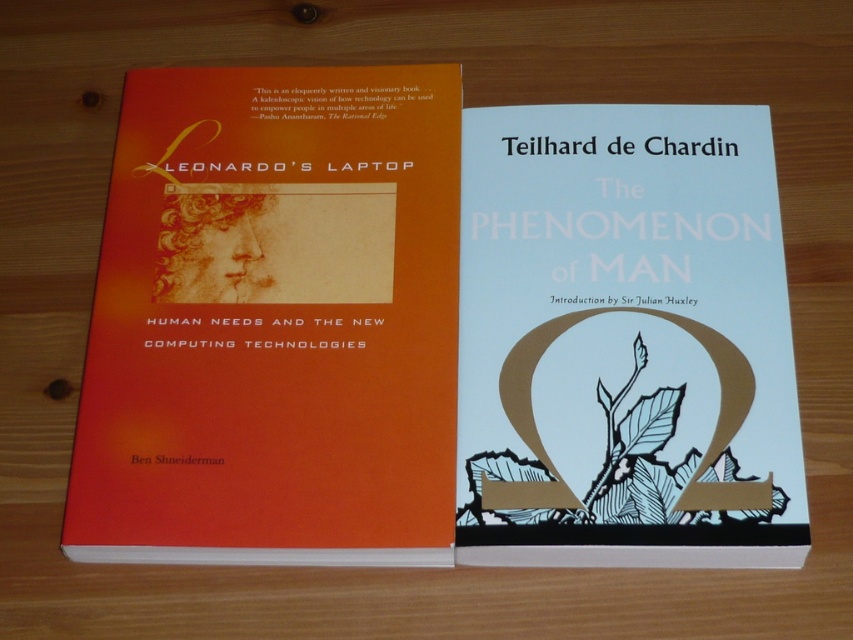
Question: Which of the following is the farthest from the observer?

Choices:
 (A) (531, 168)
 (B) (135, 208)

Answer: (A)

Question: Can you confirm if orange matte book cover at left is wider than white paper book at center?

Choices:
 (A) no
 (B) yes

Answer: (B)

Question: Which point appears farthest from the camera in this image?

Choices:
 (A) (347, 99)
 (B) (630, 323)

Answer: (A)

Question: Can you confirm if orange matte book cover at left is smaller than white paper book at center?

Choices:
 (A) yes
 (B) no

Answer: (B)

Question: Which object is closer to the camera taking this photo?

Choices:
 (A) orange matte book cover at left
 (B) white paper book at center

Answer: (B)

Question: Where is orange matte book cover at left located in relation to white paper book at center in the image?

Choices:
 (A) below
 (B) above

Answer: (B)